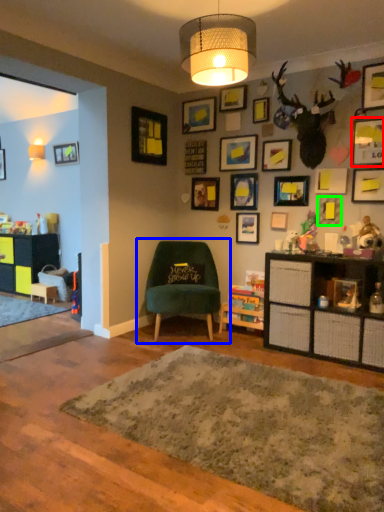
Question: Which object is positioned closest to picture frame (highlighted by a red box)? Select from chair (highlighted by a blue box) and picture frame (highlighted by a green box).

Choices:
 (A) chair
 (B) picture frame

Answer: (B)